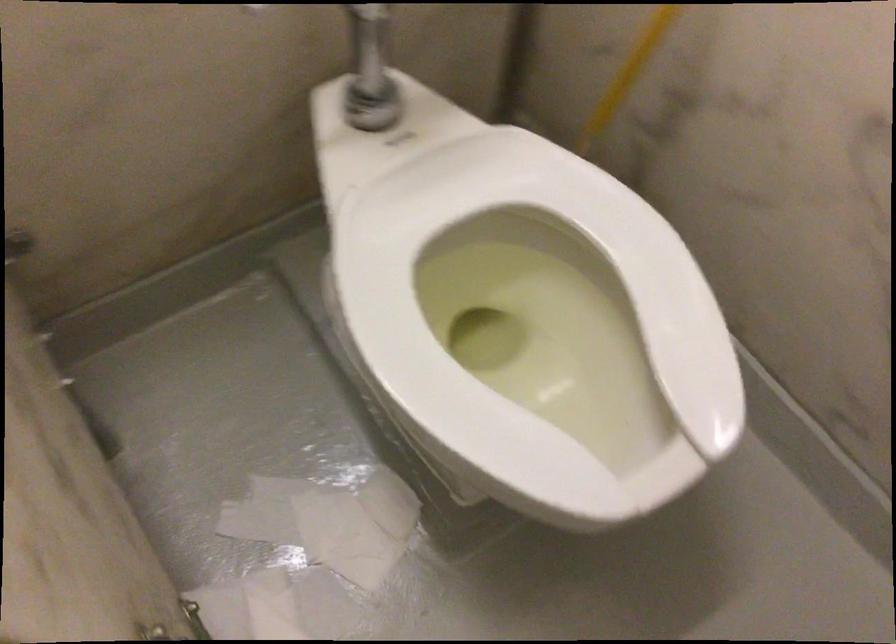
Find the location of a particular element. The width and height of the screenshot is (896, 644). white toilet seat is located at coordinates (536, 254).